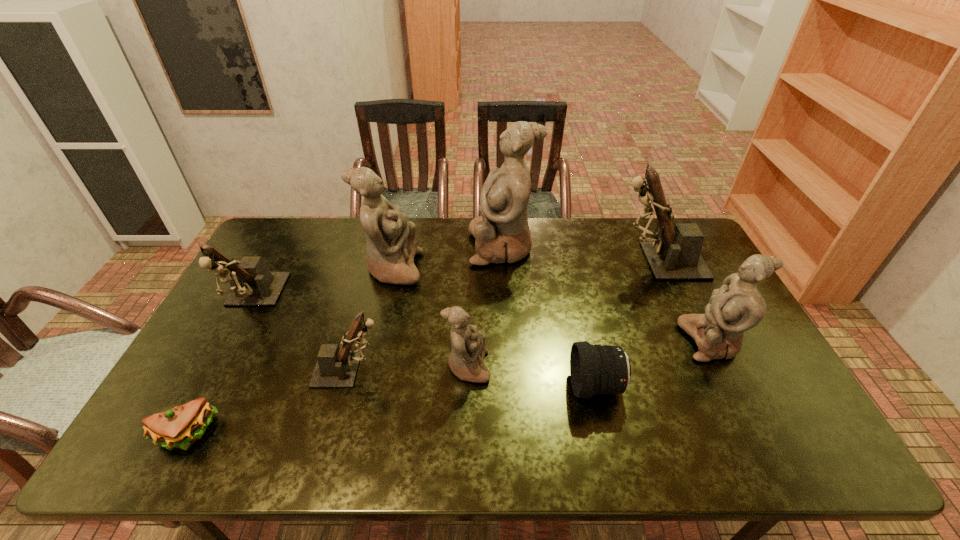
At what (x,y) coordinates should I click in order to perform the action: click on free space that satisfies the following two spatial constraints: 1. on the front-facing side of the leftmost brown figurine; 2. on the right side of the nearest object. Please return your answer as a coordinate pair (x, y). This screenshot has width=960, height=540. Looking at the image, I should click on (180, 434).

What are the coordinates of `free spot that satisfies the following two spatial constraints: 1. on the front-facing side of the third smallest white figurine; 2. on the front-facing side of the leftmost brown figurine` in the screenshot? It's located at (385, 300).